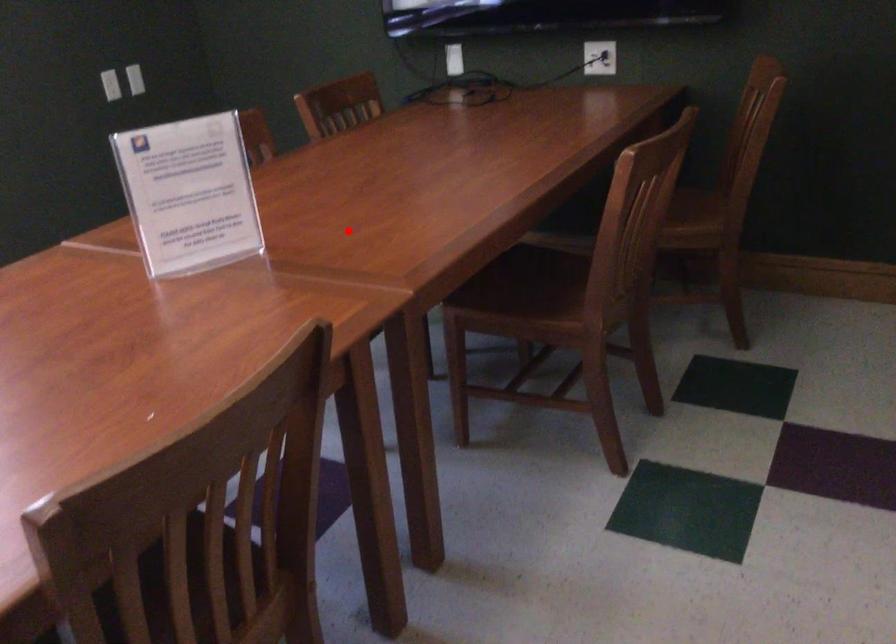
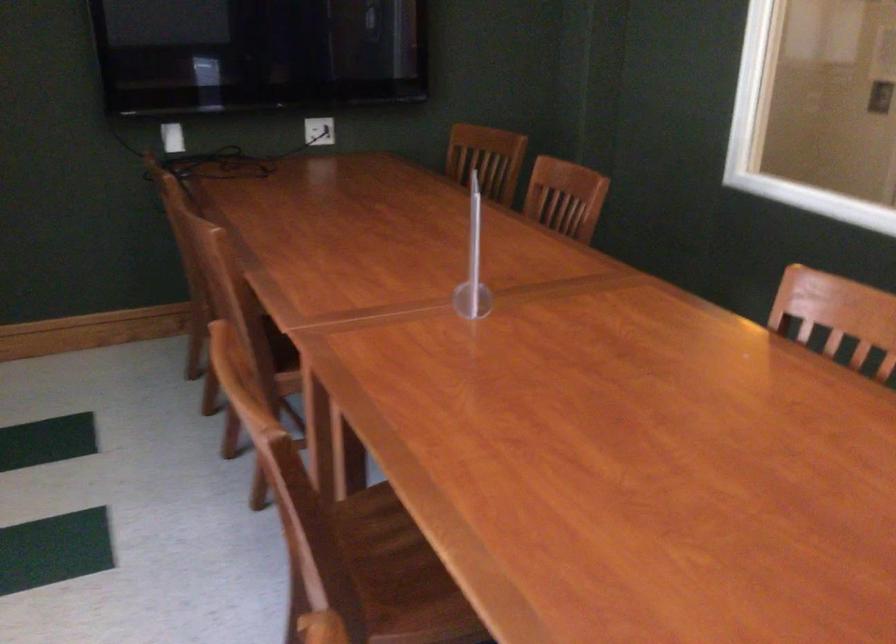
Question: I am providing you with two images of the same scene from different viewpoints. Image1 has a red point marked. In image2, the corresponding 3D location appears at what relative position? Reply with the corresponding letter.

Choices:
 (A) Closer
 (B) Farther

Answer: (B)